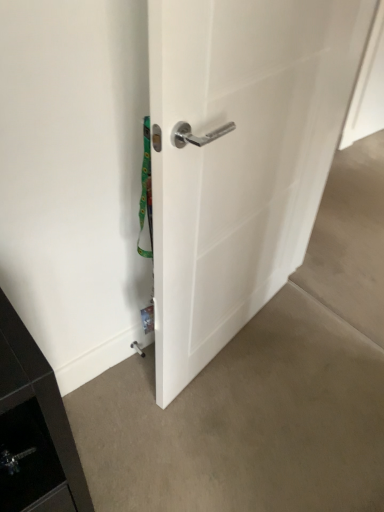
Where is `free space in front of white glossy door handle at center`? The image size is (384, 512). free space in front of white glossy door handle at center is located at coordinates (243, 418).